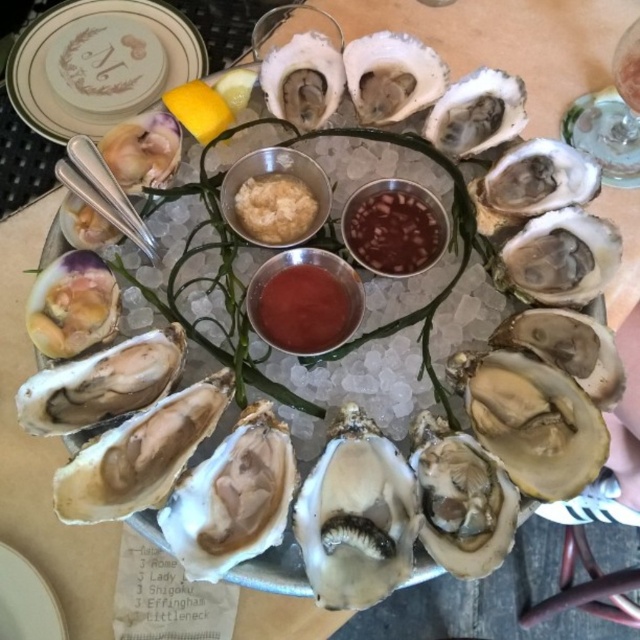
You are a food stylist arranging an oyster platter. You have a white ceramic plate at lower left and a yellow matte lemon at upper center. Which object takes up more space on the platter?

The yellow matte lemon at upper center occupies more space than the white ceramic plate at lower left.

You are standing in front of an oyster platter and want to reach for the point at coordinates point (324, 294). If your hand can extend 30 inches forward, will you be able to reach it?

The point (324, 294) is 30.29 inches away from you, so your hand can only extend 30 inches forward. Therefore, you cannot reach the point (324, 294).

You are a food stylist standing 36 inches away from the white ceramic plate at lower left. Can you reach the plate without moving your position?

The distance between you and the white ceramic plate at lower left is 32.45 inches, so yes, you can reach the plate without moving since you are standing 36 inches away, which is within reach.